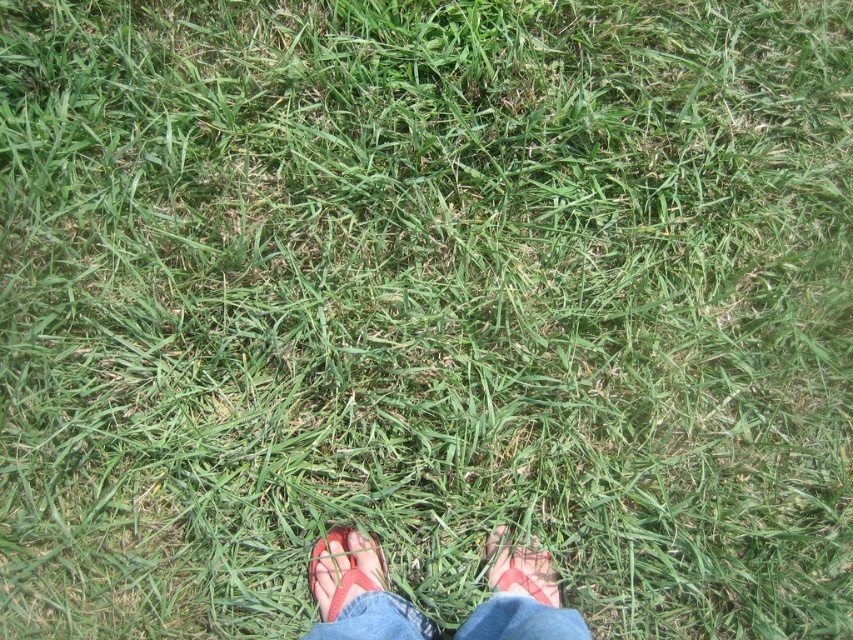
Question: Observing the image, what is the correct spatial positioning of rubber flip-flops at lower center in reference to pink fabric sandal at lower center?

Choices:
 (A) left
 (B) right

Answer: (A)

Question: Which of the following is the farthest from the observer?

Choices:
 (A) (376, 556)
 (B) (378, 600)
 (C) (556, 582)

Answer: (C)

Question: Which object is closer to the camera taking this photo?

Choices:
 (A) rubber sandal at lower center
 (B) rubber flip-flops at lower center

Answer: (B)

Question: Can you confirm if rubber flip-flops at lower center is positioned to the left of pink fabric sandal at lower center?

Choices:
 (A) no
 (B) yes

Answer: (B)

Question: Which of these objects is positioned closest to the rubber sandal at lower center?

Choices:
 (A) pink fabric sandal at lower center
 (B) blue denim jeans at lower center
 (C) rubber flip-flops at lower center

Answer: (C)

Question: Is rubber flip-flops at lower center smaller than blue denim jeans at lower center?

Choices:
 (A) yes
 (B) no

Answer: (B)